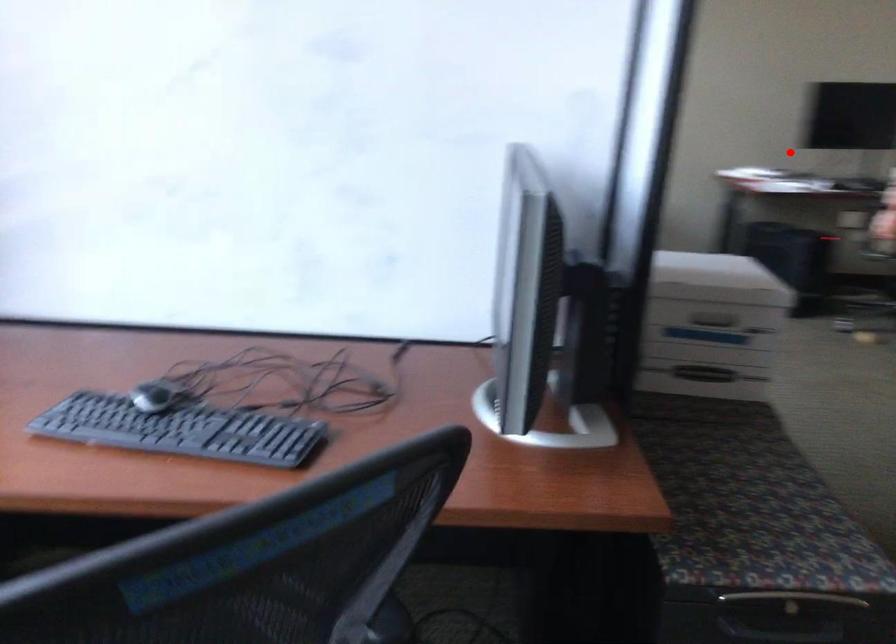
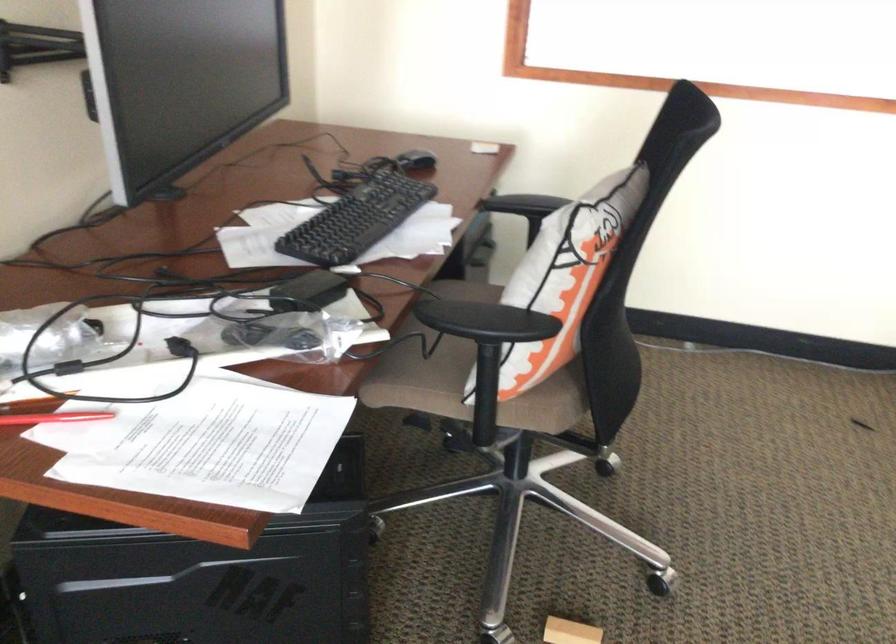
Question: I am providing you with two images of the same scene from different viewpoints. A red point is shown in image1. For the corresponding object point in image2, is it positioned nearer or farther from the camera?

Choices:
 (A) Nearer
 (B) Farther

Answer: (A)